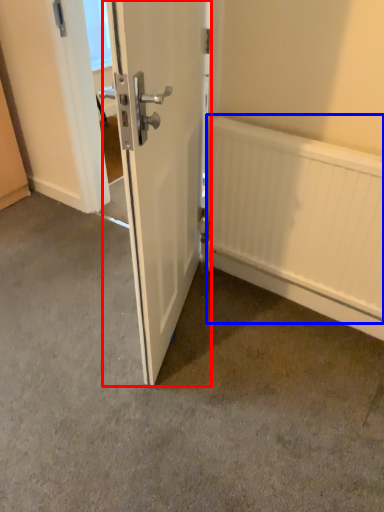
Question: Which object is further to the camera taking this photo, door (highlighted by a red box) or radiator (highlighted by a blue box)?

Choices:
 (A) door
 (B) radiator

Answer: (B)